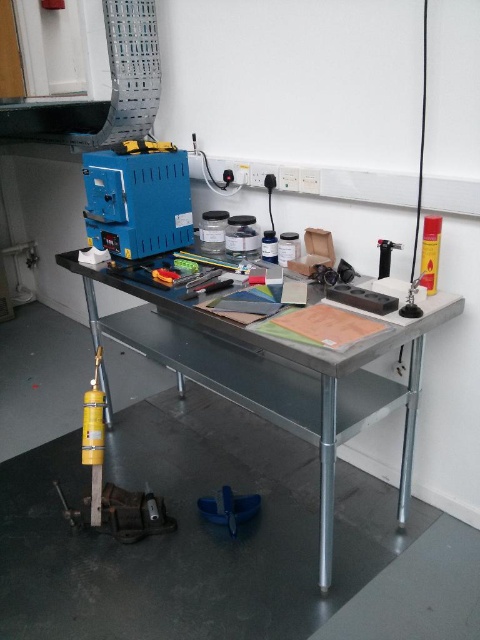
You are standing in the laboratory workspace shown. There is a point marked at coordinates (274, 374). What object is located at that point?

The point at coordinates (274, 374) is on the metallic gray table at center.

You are organizing tools on a workbench. You need to place a metallic gray table at center and a metallic silver tool at center. According to the current setup, which object is positioned to the left?

The metallic silver tool at center is positioned to the left of the metallic gray table at center.